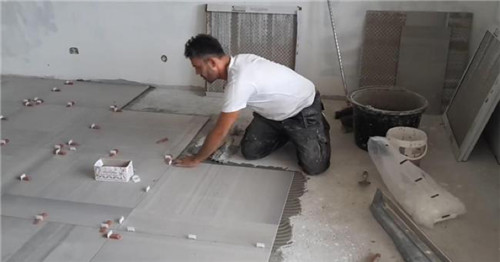
Locate an element on the screen. This screenshot has width=500, height=262. heater is located at coordinates (227, 31).